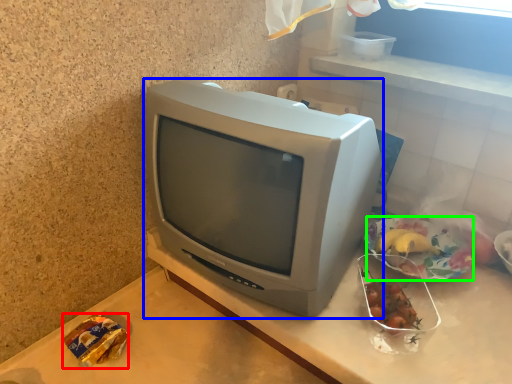
Question: Which is nearer to the food (highlighted by a red box)? television (highlighted by a blue box) or food (highlighted by a green box).

Choices:
 (A) television
 (B) food

Answer: (A)